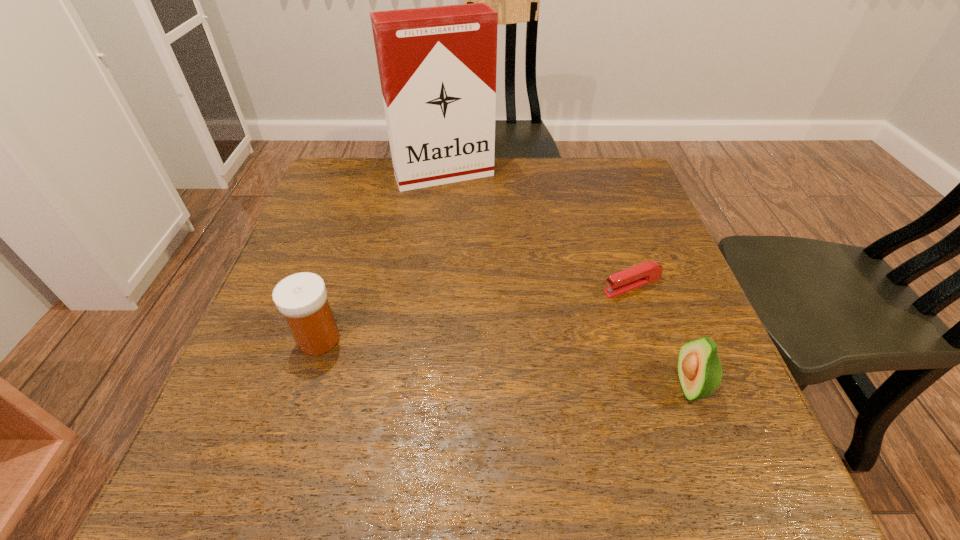
Identify the location of free point between the leftmost object and the farthest object. (381, 257).

At what (x,y) coordinates should I click in order to perform the action: click on vacant region between the avocado and the medicine. Please return your answer as a coordinate pair (x, y). The width and height of the screenshot is (960, 540). Looking at the image, I should click on (504, 362).

Locate an element on the screen. The height and width of the screenshot is (540, 960). free spot between the stapler and the leftmost object is located at coordinates (475, 312).

The height and width of the screenshot is (540, 960). Identify the location of vacant region between the nearest object and the shortest object. (661, 336).

What are the coordinates of `vacant region between the leftmost object and the avocado` in the screenshot? It's located at (504, 362).

Where is `free space between the second object from left to right and the medicine`? free space between the second object from left to right and the medicine is located at coordinates (381, 257).

Identify the location of free space between the leftmost object and the tallest object. (381, 257).

At what (x,y) coordinates should I click in order to perform the action: click on unoccupied position between the stapler and the leftmost object. Please return your answer as a coordinate pair (x, y). Looking at the image, I should click on (475, 312).

You are a GUI agent. You are given a task and a screenshot of the screen. Output one action in this format:
    pyautogui.click(x=<x>, y=<y>)
    Task: Click on the vacant space that's between the avocado and the leftmost object
    
    Given the screenshot: What is the action you would take?
    pyautogui.click(x=504, y=362)

Select which object appears as the closest to the leftmost object. Please provide its 2D coordinates. Your answer should be formatted as a tuple, i.e. [(x, y)], where the tuple contains the x and y coordinates of a point satisfying the conditions above.

[(437, 65)]